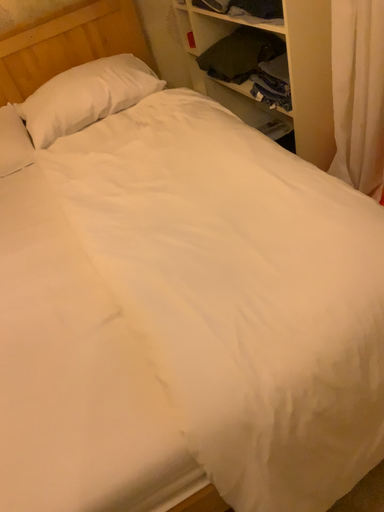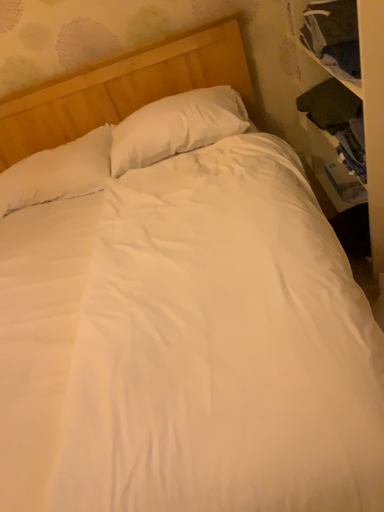
Question: Which way did the camera rotate in the video?

Choices:
 (A) rotated left
 (B) rotated right

Answer: (A)